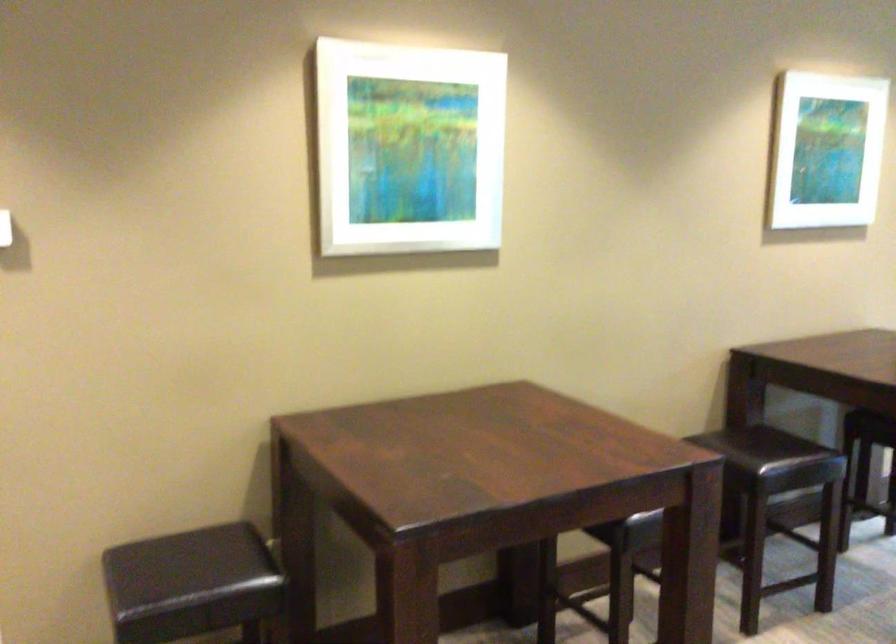
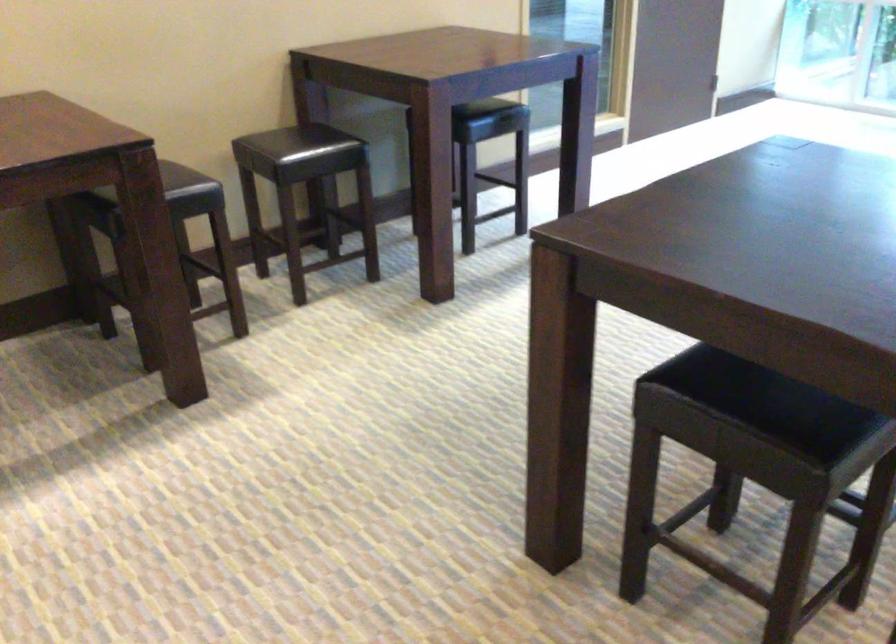
In a continuous first-person perspective shot, in which direction is the camera moving?

The movement direction of the cameraman is right, backward.